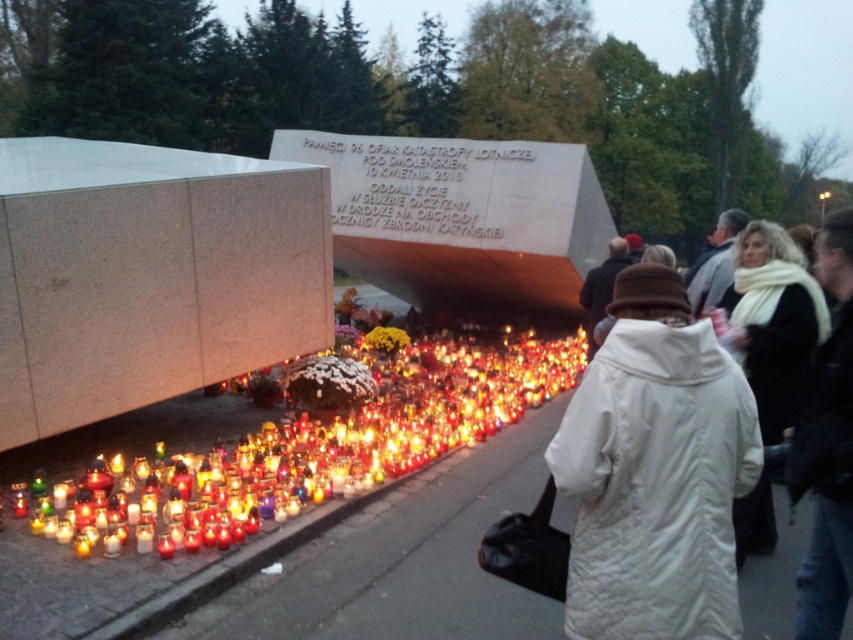
You are standing in front of the memorial monument and want to place a new candle between the two points labeled point (740, 362) and point (367, 337). Since you want the candle to be closer to the monument, which of the two points should you choose as the reference point for placement?

To place the candle closer to the monument, you should choose point (367, 337) as the reference point because it is farther from the camera compared to point (740, 362), meaning it is physically closer to the monument.

You are a photographer standing at the base of the monument. You want to capture a photo of the white wool scarf at upper right without including the monument in the frame. Which direction should you move to ensure the monument is out of the shot?

Move to the right so that the monument is no longer in your field of view.

You are standing at the memorial site and want to place a new candle. You have two options for placement based on coordinates given in the image. The first option is at point (345,365) and the second is at point (376,326). Which point is closer to you where you can place the candle more easily?

Point (345,365) is closer to the camera than point (376,326), so placing the candle at point (345,365) would be easier as it is nearer to your current position.